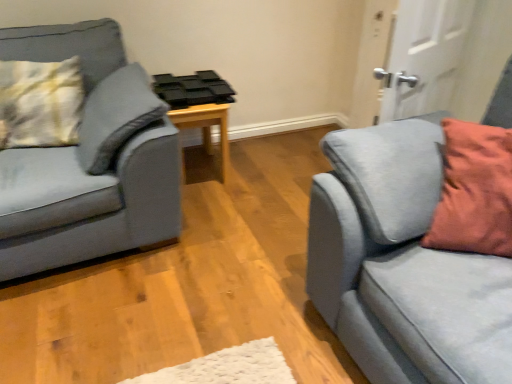
From the picture: In order to face yellow-green textured pillow at left, should I rotate leftwards or rightwards?

To align with it, rotate left about 27.708°.

Find the location of a particular element. This screenshot has height=384, width=512. yellow-green textured pillow at left is located at coordinates (40, 103).

Locate an element on the screen. The height and width of the screenshot is (384, 512). suede gray couch at right, which appears as the 1th studio couch when viewed from the right is located at coordinates (402, 263).

From the image's perspective, is suede gray couch at right, which appears as the 1th studio couch when viewed from the right, positioned above or below yellow-green textured pillow at left?

From the image's perspective, suede gray couch at right, which appears as the 1th studio couch when viewed from the right, appears below yellow-green textured pillow at left.

From a real-world perspective, which is physically above, suede gray couch at right, which appears as the 1th studio couch when viewed from the right, or yellow-green textured pillow at left?

yellow-green textured pillow at left, from a real-world perspective.

Which object is further away from the camera, suede gray couch at right, the 2th studio couch from the left, or yellow-green textured pillow at left?

yellow-green textured pillow at left is behind.

Considering the sizes of objects suede gray couch at right, the 2th studio couch from the left, and yellow-green textured pillow at left in the image provided, who is bigger, suede gray couch at right, the 2th studio couch from the left, or yellow-green textured pillow at left?

suede gray couch at right, the 2th studio couch from the left.

Who is more distant, white matte door at upper right or suede gray couch at right, which appears as the 1th studio couch when viewed from the right?

white matte door at upper right is further away from the camera.

In the scene shown: Which of these two, white matte door at upper right or suede gray couch at right, the 2th studio couch from the left, stands shorter?

With less height is white matte door at upper right.

Considering the positions of objects white matte door at upper right and suede gray couch at right, which appears as the 1th studio couch when viewed from the right, in the image provided, who is more to the right, white matte door at upper right or suede gray couch at right, which appears as the 1th studio couch when viewed from the right,?

white matte door at upper right is more to the right.

In the scene shown: Looking at their sizes, would you say white matte door at upper right is wider or thinner than suede gray couch at right, the 2th studio couch from the left?

white matte door at upper right is thinner than suede gray couch at right, the 2th studio couch from the left.

From the image's perspective, which is below, black plastic tray at center or yellow-green textured pillow at left?

black plastic tray at center is shown below in the image.

Is point (223, 172) closer or farther from the camera than point (44, 138)?

Point (223, 172) is farther from the camera than point (44, 138).

Is black plastic tray at center oriented towards yellow-green textured pillow at left?

No, black plastic tray at center is not facing towards yellow-green textured pillow at left.

Would you say white matte door at upper right is a long distance from black plastic tray at center?

Indeed, white matte door at upper right is not near black plastic tray at center.

Which point is more distant from viewer, [446,42] or [173,112]?

Point [173,112]

Which object is thinner, white matte door at upper right or black plastic tray at center?

Thinner between the two is white matte door at upper right.

There is a black plastic tray at center. Where is `door above it (from a real-world perspective)`? door above it (from a real-world perspective) is located at coordinates (425, 56).

What's the angular difference between yellow-green textured pillow at left and suede gray couch at right, the 2th studio couch from the left,'s facing directions?

yellow-green textured pillow at left and suede gray couch at right, the 2th studio couch from the left, are facing 70.8 degrees away from each other.

From the image's perspective, is yellow-green textured pillow at left located beneath suede gray couch at right, which appears as the 1th studio couch when viewed from the right?

Incorrect, from the image's perspective, yellow-green textured pillow at left is higher than suede gray couch at right, which appears as the 1th studio couch when viewed from the right.

Locate an element on the screen. The height and width of the screenshot is (384, 512). pillow above the suede gray couch at right, the 2th studio couch from the left (from a real-world perspective) is located at coordinates (40, 103).

Considering the points (45, 101) and (470, 297), which point is behind, point (45, 101) or point (470, 297)?

The point (45, 101) is behind.

Is white matte door at upper right touching velvet grey couch at left, placed as the first studio couch when sorted from left to right?

white matte door at upper right is not next to velvet grey couch at left, placed as the first studio couch when sorted from left to right, and they're not touching.

Is velvet grey couch at left, the second studio couch in the right-to-left sequence, at the back of white matte door at upper right?

That's not correct — white matte door at upper right is not looking away from velvet grey couch at left, the second studio couch in the right-to-left sequence.

Who is bigger, white matte door at upper right or velvet grey couch at left, the second studio couch in the right-to-left sequence?

With larger size is velvet grey couch at left, the second studio couch in the right-to-left sequence.

Between white matte door at upper right and velvet grey couch at left, placed as the first studio couch when sorted from left to right, which one has smaller width?

white matte door at upper right.

Choose the correct answer: Is suede gray couch at right, which appears as the 1th studio couch when viewed from the right, inside black plastic tray at center or outside it?

suede gray couch at right, which appears as the 1th studio couch when viewed from the right, lies outside black plastic tray at center.

From a real-world perspective, which is physically below, suede gray couch at right, which appears as the 1th studio couch when viewed from the right, or black plastic tray at center?

black plastic tray at center.

Is suede gray couch at right, the 2th studio couch from the left, wider than black plastic tray at center?

Yes.

Could you tell me if suede gray couch at right, which appears as the 1th studio couch when viewed from the right, is turned towards black plastic tray at center?

No.

Locate an element on the screen. pillow lying on the left of suede gray couch at right, which appears as the 1th studio couch when viewed from the right is located at coordinates tap(40, 103).

From the white matte door at upper right, count 2nd studio couchs forward and point to it. Please provide its 2D coordinates.

[(402, 263)]

Based on their spatial positions, is suede gray couch at right, the 2th studio couch from the left, or white matte door at upper right closer to velvet grey couch at left, placed as the first studio couch when sorted from left to right?

Among the two, suede gray couch at right, the 2th studio couch from the left, is located nearer to velvet grey couch at left, placed as the first studio couch when sorted from left to right.

From the image, which object appears to be farther from suede gray couch at right, the 2th studio couch from the left, velvet grey couch at left, placed as the first studio couch when sorted from left to right, or black plastic tray at center?

black plastic tray at center lies further to suede gray couch at right, the 2th studio couch from the left, than the other object.

Looking at this image, considering their positions, is yellow-green textured pillow at left positioned closer to suede gray couch at right, which appears as the 1th studio couch when viewed from the right, than white matte door at upper right?

Among the two, white matte door at upper right is located nearer to suede gray couch at right, which appears as the 1th studio couch when viewed from the right.

Looking at the image, which one is located closer to white matte door at upper right, velvet grey couch at left, the second studio couch in the right-to-left sequence, or black plastic tray at center?

black plastic tray at center.

Looking at the image, which one is located further to velvet grey couch at left, the second studio couch in the right-to-left sequence, yellow-green textured pillow at left or suede gray couch at right, which appears as the 1th studio couch when viewed from the right?

suede gray couch at right, which appears as the 1th studio couch when viewed from the right, lies further to velvet grey couch at left, the second studio couch in the right-to-left sequence, than the other object.

When comparing their distances from white matte door at upper right, does suede gray couch at right, the 2th studio couch from the left, or black plastic tray at center seem closer?

The object closer to white matte door at upper right is suede gray couch at right, the 2th studio couch from the left.

Estimate the real-world distances between objects in this image. Which object is further from yellow-green textured pillow at left, suede gray couch at right, which appears as the 1th studio couch when viewed from the right, or black plastic tray at center?

suede gray couch at right, which appears as the 1th studio couch when viewed from the right.

Estimate the real-world distances between objects in this image. Which object is closer to suede gray couch at right, which appears as the 1th studio couch when viewed from the right, black plastic tray at center or white matte door at upper right?

white matte door at upper right is positioned closer to the anchor suede gray couch at right, which appears as the 1th studio couch when viewed from the right.

Find the location of `pillow between velvet grey couch at left, placed as the first studio couch when sorted from left to right, and black plastic tray at center in the front-back direction`. pillow between velvet grey couch at left, placed as the first studio couch when sorted from left to right, and black plastic tray at center in the front-back direction is located at coordinates (40, 103).

Locate an element on the screen. The height and width of the screenshot is (384, 512). table located between yellow-green textured pillow at left and white matte door at upper right in the left-right direction is located at coordinates (206, 127).

Locate an element on the screen. The width and height of the screenshot is (512, 384). door positioned between suede gray couch at right, which appears as the 1th studio couch when viewed from the right, and black plastic tray at center from near to far is located at coordinates (425, 56).

Where is `studio couch located between yellow-green textured pillow at left and suede gray couch at right, the 2th studio couch from the left, in the left-right direction`? The image size is (512, 384). studio couch located between yellow-green textured pillow at left and suede gray couch at right, the 2th studio couch from the left, in the left-right direction is located at coordinates (85, 167).